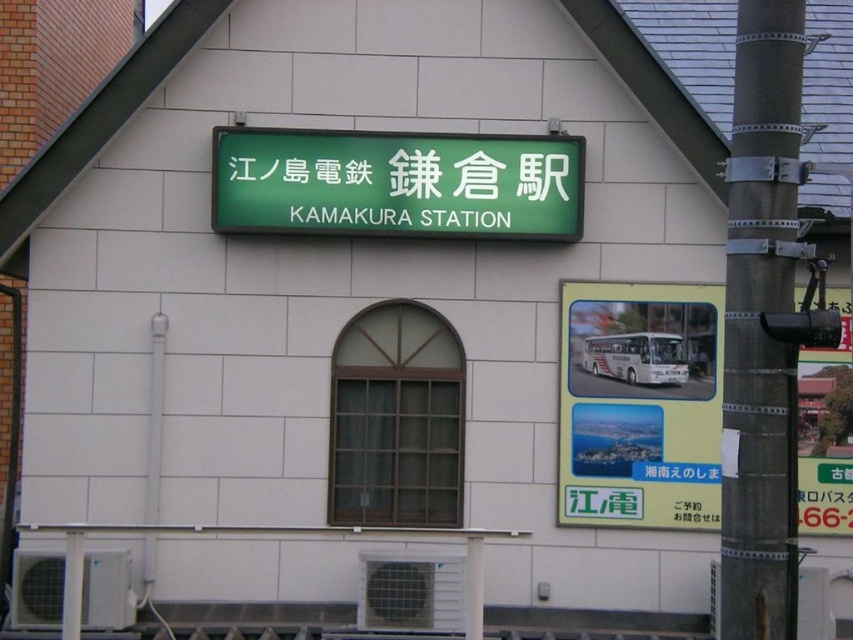
Question: Observing the image, what is the correct spatial positioning of green plastic signboard at center in reference to green matte signboard at center?

Choices:
 (A) right
 (B) left

Answer: (A)

Question: Which is farther from the green matte signboard at center?

Choices:
 (A) green plastic signboard at center
 (B) metallic gray pole at right

Answer: (B)

Question: Which object appears closest to the camera in this image?

Choices:
 (A) green plastic signboard at center
 (B) metallic gray pole at right
 (C) green matte signboard at center

Answer: (B)

Question: Is green plastic signboard at center positioned at the back of green matte signboard at center?

Choices:
 (A) no
 (B) yes

Answer: (B)

Question: Is metallic gray pole at right bigger than green matte signboard at center?

Choices:
 (A) yes
 (B) no

Answer: (A)

Question: Estimate the real-world distances between objects in this image. Which object is farther from the metallic gray pole at right?

Choices:
 (A) green matte signboard at center
 (B) green plastic signboard at center

Answer: (A)